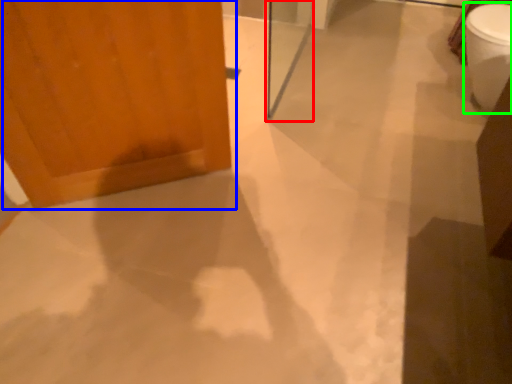
Question: Which object is the closest to the screen door (highlighted by a red box)? Choose among these: door (highlighted by a blue box) or toilet bowl (highlighted by a green box).

Choices:
 (A) door
 (B) toilet bowl

Answer: (A)